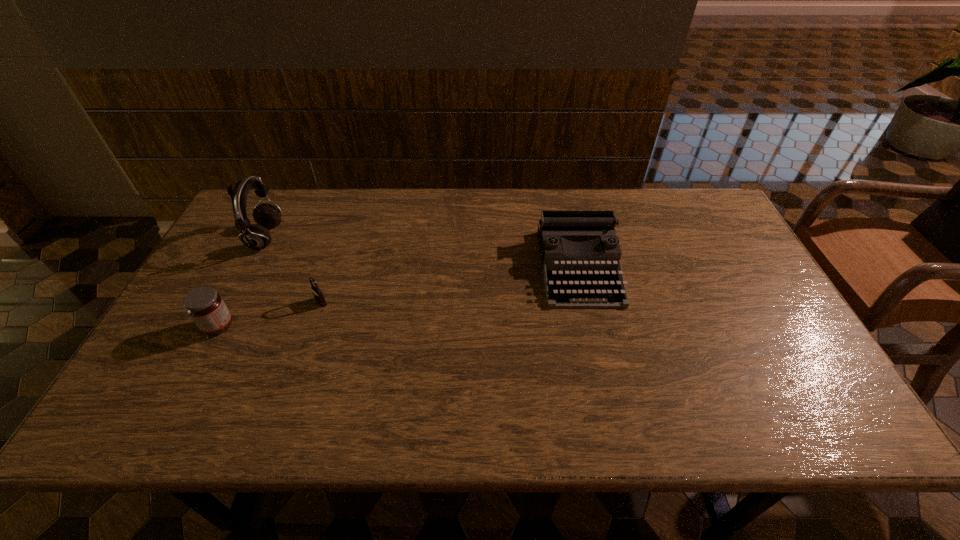
This screenshot has height=540, width=960. Identify the location of vacant region between the jam and the rightmost object. (398, 296).

Find the location of a particular element. This screenshot has height=540, width=960. vacant space that's between the jam and the rightmost object is located at coordinates (398, 296).

This screenshot has width=960, height=540. What are the coordinates of `vacant area that lies between the typewriter and the earphone` in the screenshot? It's located at (422, 252).

I want to click on free spot between the rightmost object and the tallest object, so click(x=422, y=252).

Where is `free space between the shortest object and the earphone`? free space between the shortest object and the earphone is located at coordinates (293, 270).

The width and height of the screenshot is (960, 540). In order to click on vacant area that lies between the typewriter and the earphone in this screenshot , I will do `click(422, 252)`.

Where is `vacant space in between the typewriter and the padlock`? Image resolution: width=960 pixels, height=540 pixels. vacant space in between the typewriter and the padlock is located at coordinates (x=450, y=285).

You are a GUI agent. You are given a task and a screenshot of the screen. Output one action in this format:
    pyautogui.click(x=<x>, y=<y>)
    Task: Click on the vacant space that is in between the third object from left to right and the jam
    The width and height of the screenshot is (960, 540).
    Given the screenshot: What is the action you would take?
    pyautogui.click(x=270, y=314)

The width and height of the screenshot is (960, 540). In order to click on object that ranks as the second closest to the nearest object in this screenshot , I will do coord(257,237).

Locate an element on the screen. This screenshot has width=960, height=540. object that is the closest to the jam is located at coordinates (318, 295).